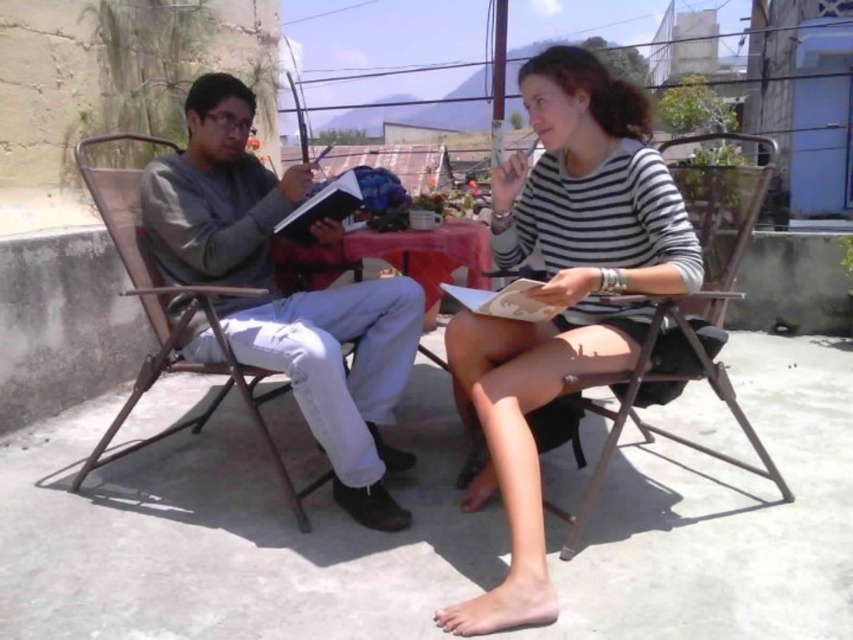
Is matte gray sweater at upper left to the right of metallic silver chair at center from the viewer's perspective?

No, matte gray sweater at upper left is not to the right of metallic silver chair at center.

Can you confirm if matte gray sweater at upper left is positioned above metallic silver chair at center?

No, matte gray sweater at upper left is not above metallic silver chair at center.

Does point (508, 384) come behind point (715, 250)?

No.

The width and height of the screenshot is (853, 640). In order to click on matte gray sweater at upper left in this screenshot , I will do `click(561, 296)`.

Is matte gray sweater at upper left shorter than white striped shirt at center?

Correct, matte gray sweater at upper left is not as tall as white striped shirt at center.

Who is more forward, (572,122) or (523,86)?

Point (572,122) is more forward.

Does point (460, 356) come farther from viewer compared to point (544, 348)?

Yes, point (460, 356) is behind point (544, 348).

I want to click on matte gray sweater at upper left, so click(x=561, y=296).

Between light gray sweater at left and metallic silver chair at center, which one is positioned lower?

Positioned lower is metallic silver chair at center.

Is light gray sweater at left positioned before metallic silver chair at center?

No, it is not.

Does point (341, 492) lie in front of point (769, 186)?

No.

Locate an element on the screen. The width and height of the screenshot is (853, 640). light gray sweater at left is located at coordinates (283, 296).